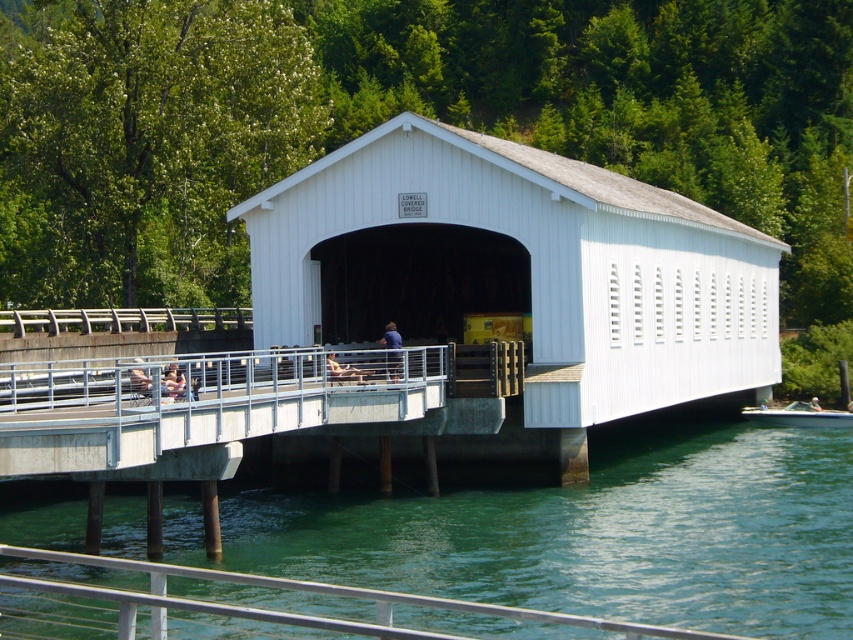
Question: Which object is farther from the camera taking this photo?

Choices:
 (A) white plastic boat at lower right
 (B) smooth tan skin at center

Answer: (A)

Question: Does green translucent water at lower center have a greater width compared to white plastic boat at lower right?

Choices:
 (A) yes
 (B) no

Answer: (A)

Question: Can you confirm if blue fabric shirt at center is thinner than green fabric kayak at center?

Choices:
 (A) no
 (B) yes

Answer: (B)

Question: Considering the relative positions of blue fabric shirt at center and light brown wooden chair at center in the image provided, where is blue fabric shirt at center located with respect to light brown wooden chair at center?

Choices:
 (A) left
 (B) right

Answer: (B)

Question: Which point is closer to the camera?

Choices:
 (A) matte pink shirt at center
 (B) green fabric kayak at center
 (C) blue fabric shirt at center

Answer: (A)

Question: Which point is closer to the camera?

Choices:
 (A) (351, 369)
 (B) (132, 362)

Answer: (A)